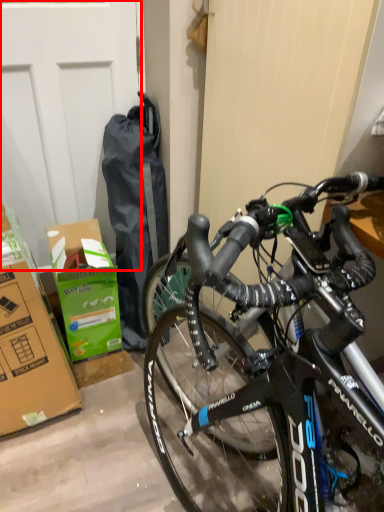
Question: From the image's perspective, where is garage door (annotated by the red box) located relative to cardboard box?

Choices:
 (A) below
 (B) above

Answer: (B)